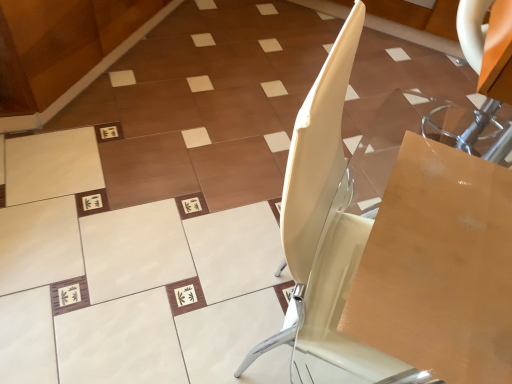
Identify the location of vacant space that is to the left of white glossy chair at center. The height and width of the screenshot is (384, 512). (197, 299).